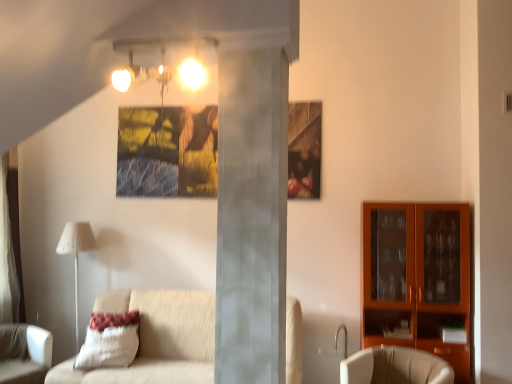
Question: From a real-world perspective, is white fabric chair at lower left, arranged as the first chair when viewed from the left, under beige fabric chair at lower right, which appears as the 2th chair when viewed from the left?

Choices:
 (A) yes
 (B) no

Answer: (A)

Question: Could you tell me if white fabric chair at lower left, arranged as the first chair when viewed from the left, is facing beige fabric chair at lower right, which appears as the 1th chair when viewed from the right?

Choices:
 (A) no
 (B) yes

Answer: (A)

Question: Can you confirm if white fabric chair at lower left, arranged as the first chair when viewed from the left, is thinner than beige fabric chair at lower right, which appears as the 2th chair when viewed from the left?

Choices:
 (A) no
 (B) yes

Answer: (A)

Question: Considering the relative sizes of white fabric chair at lower left, arranged as the first chair when viewed from the left, and beige fabric chair at lower right, which appears as the 2th chair when viewed from the left, in the image provided, is white fabric chair at lower left, arranged as the first chair when viewed from the left, smaller than beige fabric chair at lower right, which appears as the 2th chair when viewed from the left,?

Choices:
 (A) no
 (B) yes

Answer: (A)

Question: From the image's perspective, is white fabric chair at lower left, arranged as the 2th chair when viewed from the right, under beige fabric chair at lower right, which appears as the 1th chair when viewed from the right?

Choices:
 (A) no
 (B) yes

Answer: (B)

Question: In terms of width, does white textured pillow at lower left look wider or thinner when compared to matte glass light fixture at upper center?

Choices:
 (A) thin
 (B) wide

Answer: (A)

Question: In terms of height, does white textured pillow at lower left look taller or shorter compared to matte glass light fixture at upper center?

Choices:
 (A) tall
 (B) short

Answer: (A)

Question: Is white textured pillow at lower left inside or outside of matte glass light fixture at upper center?

Choices:
 (A) outside
 (B) inside

Answer: (A)

Question: Is point (121, 354) closer or farther from the camera than point (195, 87)?

Choices:
 (A) closer
 (B) farther

Answer: (B)

Question: From their relative heights in the image, would you say matte glass light fixture at upper center is taller or shorter than matte orange cabinet at right?

Choices:
 (A) short
 (B) tall

Answer: (A)

Question: Relative to matte orange cabinet at right, is matte glass light fixture at upper center in front or behind?

Choices:
 (A) behind
 (B) front

Answer: (B)

Question: Considering the positions of matte glass light fixture at upper center and matte orange cabinet at right in the image, is matte glass light fixture at upper center bigger or smaller than matte orange cabinet at right?

Choices:
 (A) big
 (B) small

Answer: (B)

Question: From a real-world perspective, relative to matte orange cabinet at right, is matte glass light fixture at upper center vertically above or below?

Choices:
 (A) below
 (B) above

Answer: (B)

Question: Is white fabric chair at lower left, arranged as the 2th chair when viewed from the right, in front of or behind white textured pillow at lower left in the image?

Choices:
 (A) front
 (B) behind

Answer: (A)

Question: From their relative heights in the image, would you say white fabric chair at lower left, arranged as the 2th chair when viewed from the right, is taller or shorter than white textured pillow at lower left?

Choices:
 (A) short
 (B) tall

Answer: (B)